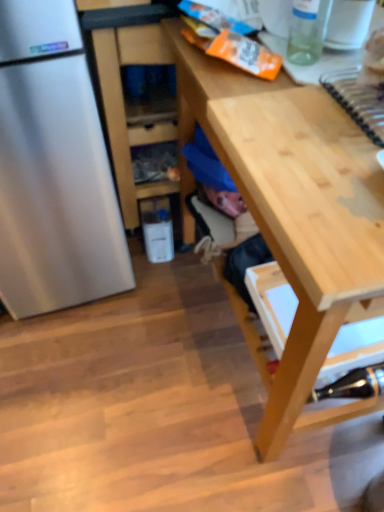
Where is `free space on the front side of transparent glass bottle at upper right, the second bottle from the right`? free space on the front side of transparent glass bottle at upper right, the second bottle from the right is located at coordinates pos(302,79).